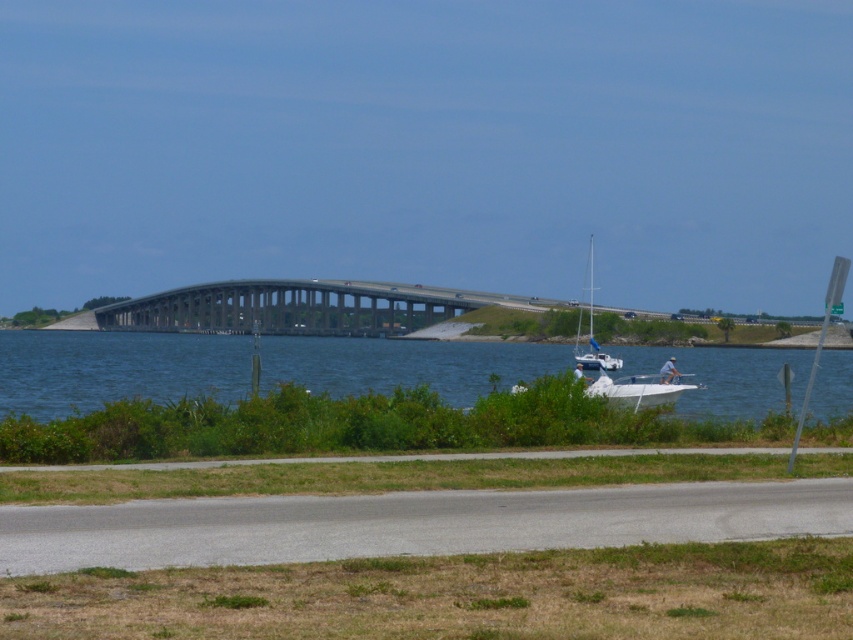
Can you confirm if blue water at lower center is shorter than white matte sailboat at center-right?

Indeed, blue water at lower center has a lesser height compared to white matte sailboat at center-right.

Who is positioned more to the left, blue water at lower center or white matte sailboat at center-right?

blue water at lower center

This screenshot has width=853, height=640. What do you see at coordinates (115, 369) in the screenshot?
I see `blue water at lower center` at bounding box center [115, 369].

The width and height of the screenshot is (853, 640). Find the location of `blue water at lower center`. blue water at lower center is located at coordinates [x=115, y=369].

Is blue water at lower center to the left of gray concrete bridge at center from the viewer's perspective?

In fact, blue water at lower center is to the right of gray concrete bridge at center.

Does blue water at lower center appear under gray concrete bridge at center?

Indeed, blue water at lower center is positioned under gray concrete bridge at center.

Is point (350, 392) more distant than point (223, 328)?

No, (350, 392) is closer to viewer.

Find the location of a particular element. The image size is (853, 640). blue water at lower center is located at coordinates (115, 369).

Can you confirm if gray concrete bridge at center is thinner than white matte sailboat at center-right?

In fact, gray concrete bridge at center might be wider than white matte sailboat at center-right.

This screenshot has height=640, width=853. What do you see at coordinates (293, 307) in the screenshot?
I see `gray concrete bridge at center` at bounding box center [293, 307].

Where is `gray concrete bridge at center`? gray concrete bridge at center is located at coordinates (293, 307).